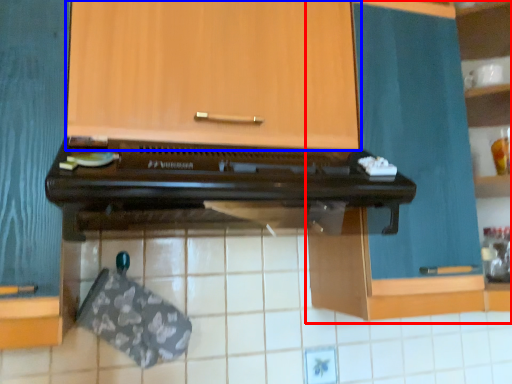
Question: Which of the following is the farthest to the observer, cabinetry (highlighted by a red box) or cabinetry (highlighted by a blue box)?

Choices:
 (A) cabinetry
 (B) cabinetry

Answer: (A)